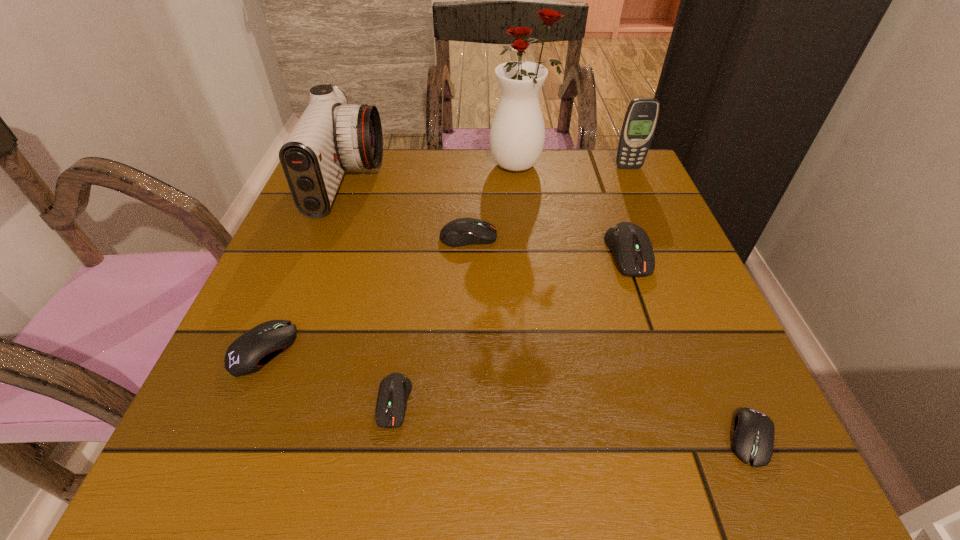
The width and height of the screenshot is (960, 540). What are the coordinates of `the third closest dark computer equipment to the tallest object` in the screenshot? It's located at (394, 390).

Image resolution: width=960 pixels, height=540 pixels. In order to click on dark computer equipment that is the second nearest to the second dark computer equipment from left to right in this screenshot , I will do `click(394, 390)`.

Where is `vacant space that satisfies the following two spatial constraints: 1. on the screen of the cellular telephone; 2. on the right side of the right black computer equipment`? This screenshot has height=540, width=960. vacant space that satisfies the following two spatial constraints: 1. on the screen of the cellular telephone; 2. on the right side of the right black computer equipment is located at coordinates (749, 438).

Find the location of a particular element. free region that satisfies the following two spatial constraints: 1. on the button of the third computer equipment from right to left; 2. on the button of the leftmost dark computer equipment is located at coordinates (464, 402).

I want to click on free point that satisfies the following two spatial constraints: 1. on the screen of the nearer black computer equipment; 2. on the left side of the gray cellular telephone, so (x=749, y=438).

Locate an element on the screen. vacant area that satisfies the following two spatial constraints: 1. on the surface of the camcorder; 2. on the right side of the nearer black computer equipment is located at coordinates (250, 438).